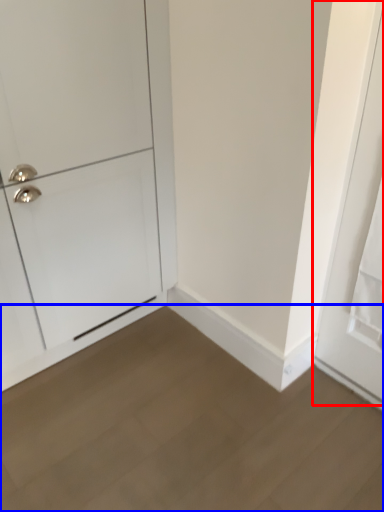
Question: Which of the following is the farthest to the observer, door (highlighted by a red box) or plain (highlighted by a blue box)?

Choices:
 (A) door
 (B) plain

Answer: (A)